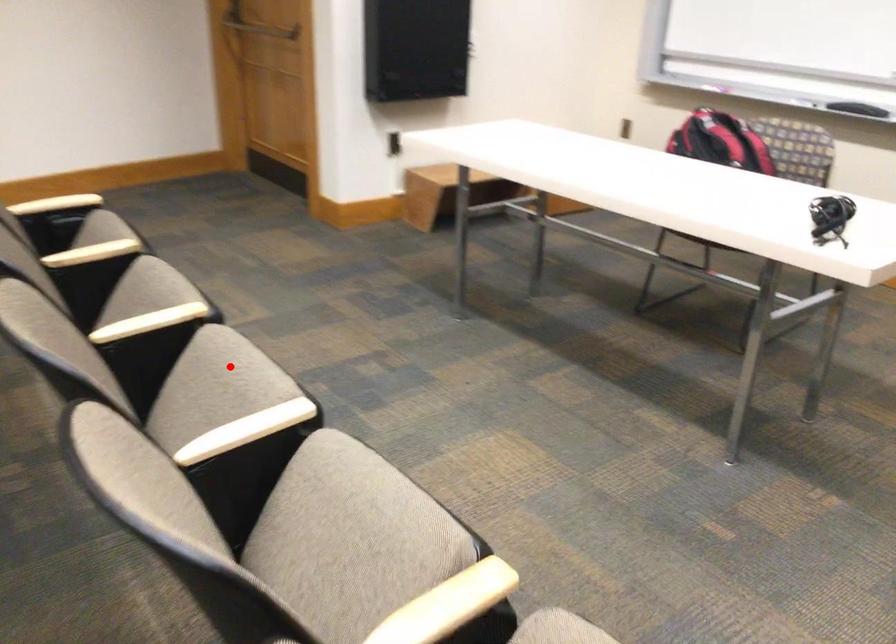
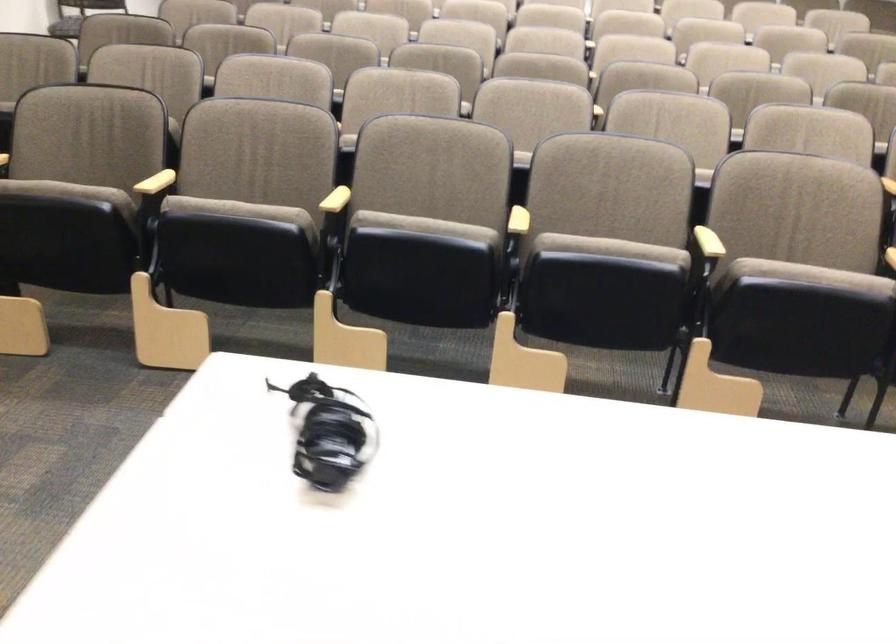
Where in the second image is the point corresponding to the highlighted location from the first image?

(610, 249)